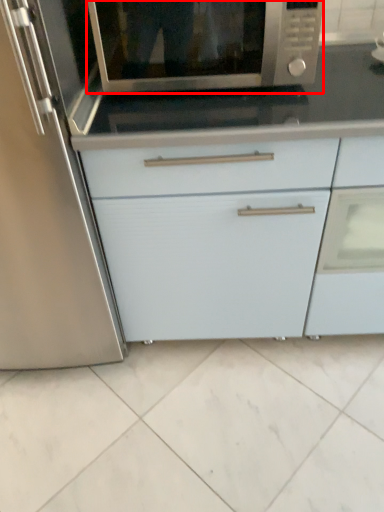
Question: In this image, where is microwave oven (annotated by the red box) located relative to cabinetry?

Choices:
 (A) right
 (B) left

Answer: (B)